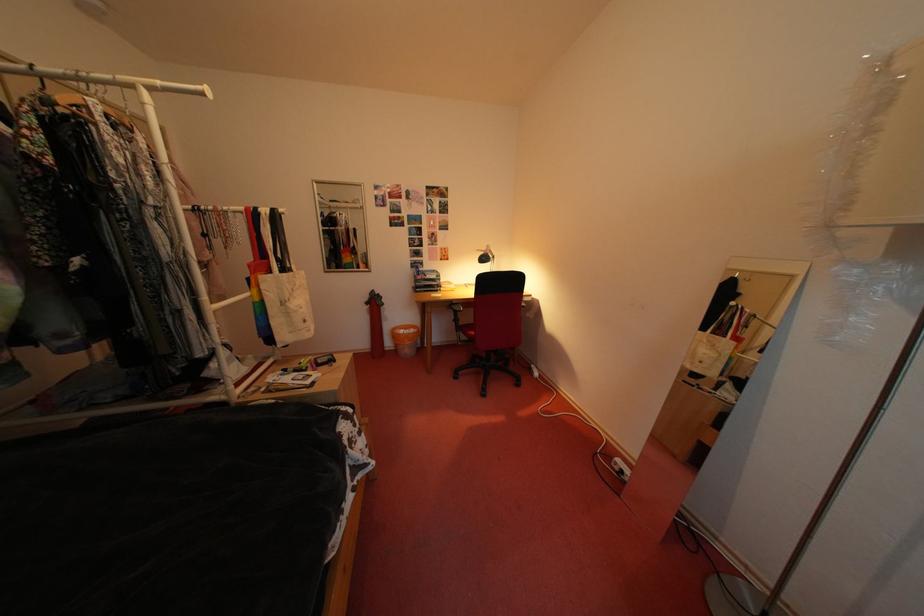
This screenshot has width=924, height=616. What do you see at coordinates (406, 339) in the screenshot? I see `the orange wastebasket` at bounding box center [406, 339].